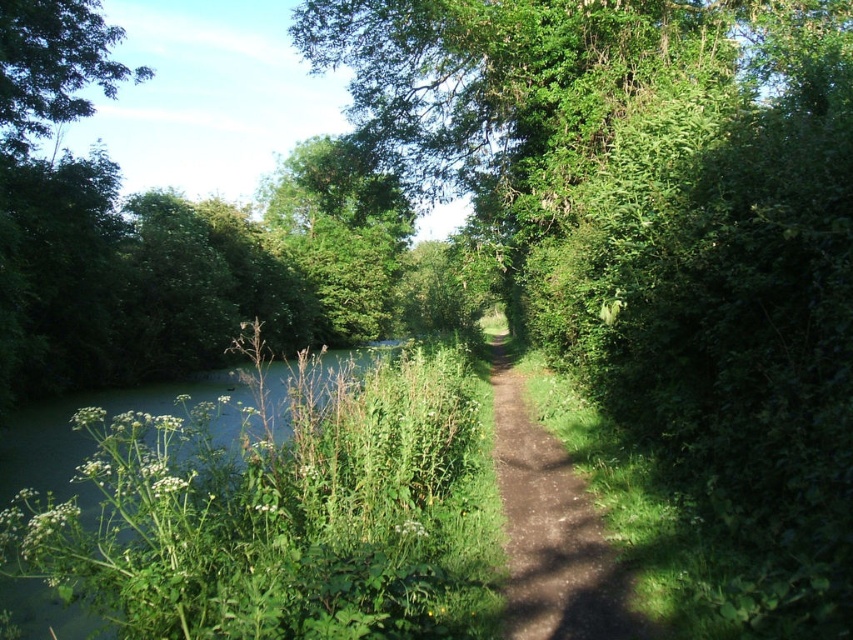
From the picture: You are a hiker standing on the brown dirt path at center and want to take a photo of the green leafy tree at upper left. Which object will appear larger in the photo if you frame both in the same shot?

The green leafy tree at upper left will appear larger in the photo because it is taller than the brown dirt path at center.

You are standing on the narrow dirt path and see two green leafy trees. One is labeled as green leafy tree at center and the other as green leafy tree at upper left. From your perspective on the path, which tree is positioned to the right side?

The green leafy tree at center is to the right of the green leafy tree at upper left, so the green leafy tree at center is positioned to the right side.

You are standing on the narrow dirt path and want to reach the green leafy tree at center. Considering the path is only 3 feet wide, can you walk directly to the tree without stepping off the path?

The distance between you and the green leafy tree at center is 10.01 feet, so yes, you can walk directly to the tree without stepping off the path as the path is wide enough for your movement.